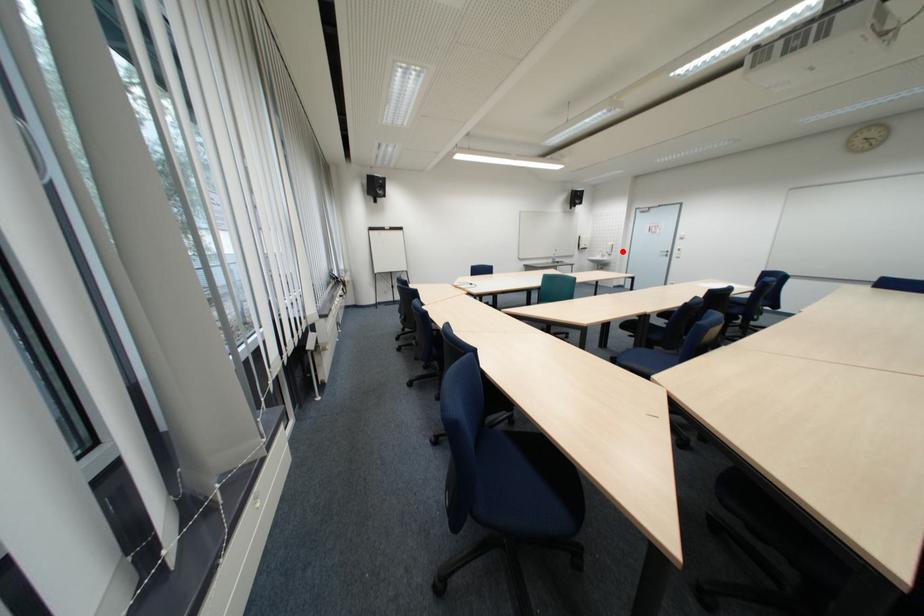
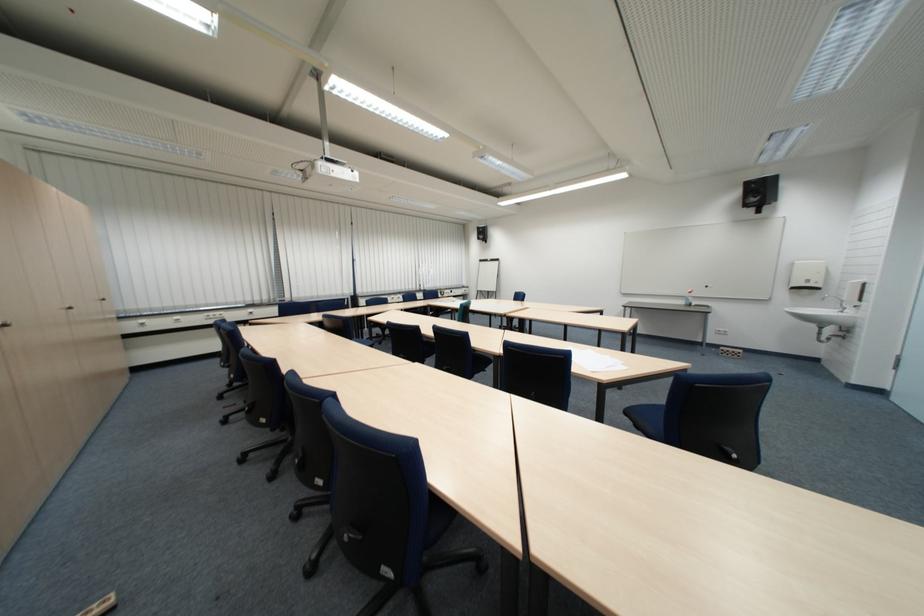
Find the pixel in the second image that matches the highlighted location in the first image.

(860, 296)